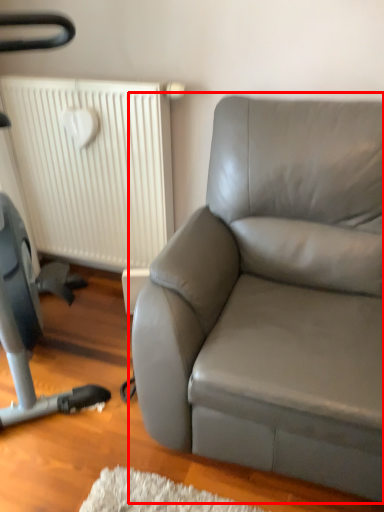
Question: From the image's perspective, what is the correct spatial positioning of studio couch (annotated by the red box) in reference to radiator?

Choices:
 (A) above
 (B) below

Answer: (B)